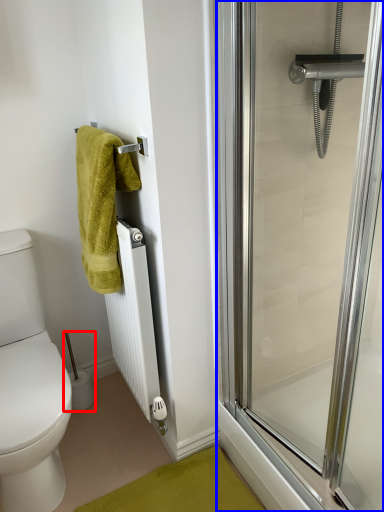
Question: Which point is closer to the camera, toilet paper (highlighted by a red box) or screen door (highlighted by a blue box)?

Choices:
 (A) toilet paper
 (B) screen door

Answer: (B)